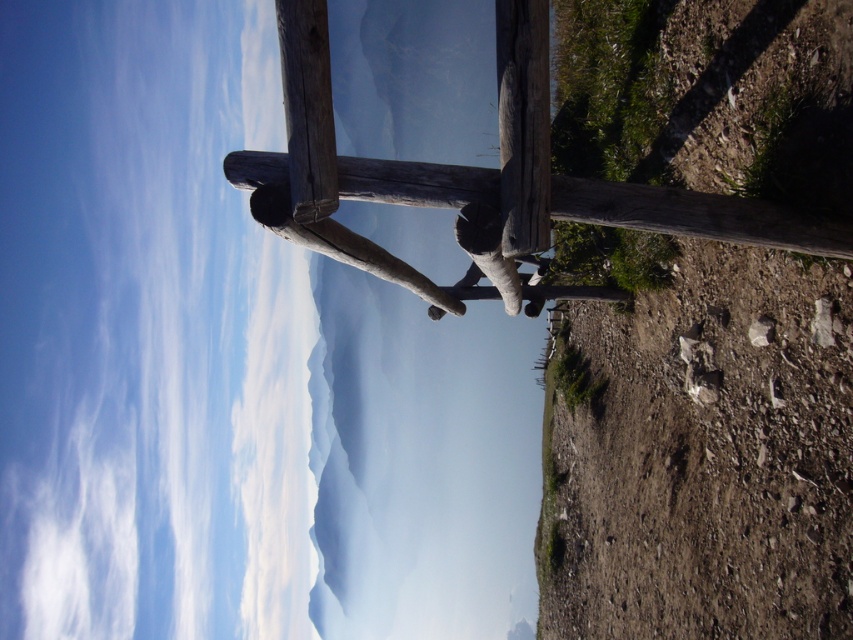
You are an architect designing a new outdoor seating area. You have two wooden pieces available for construction. One is the brown rough wood post at right, and the other is the weathered wood rail at center. Which of these two pieces has a smaller diameter?

The brown rough wood post at right is thinner than the weathered wood rail at center, so the brown rough wood post at right has a smaller diameter.

You are standing at the center of the image and want to place a new bench exactly where the weathered wood rail at center is located. What are the coordinates where you should place the bench?

The coordinates for placing the bench should be at point (695, 216), as that is where the weathered wood rail at center is located.

You are standing in front of the rustic wooden structure and want to place a small potted plant between the brown rough wood post at right and the weathered wood rail at center. Which object should the plant be closer to based on their positions?

The brown rough wood post at right is located below the weathered wood rail at center, so the plant should be placed closer to the brown rough wood post at right to be between them.